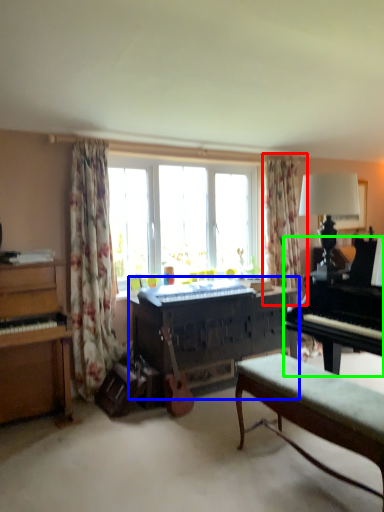
Question: Which object is the farthest from curtain (highlighted by a red box)? Choose among these: piano (highlighted by a blue box) or piano (highlighted by a green box).

Choices:
 (A) piano
 (B) piano

Answer: (B)